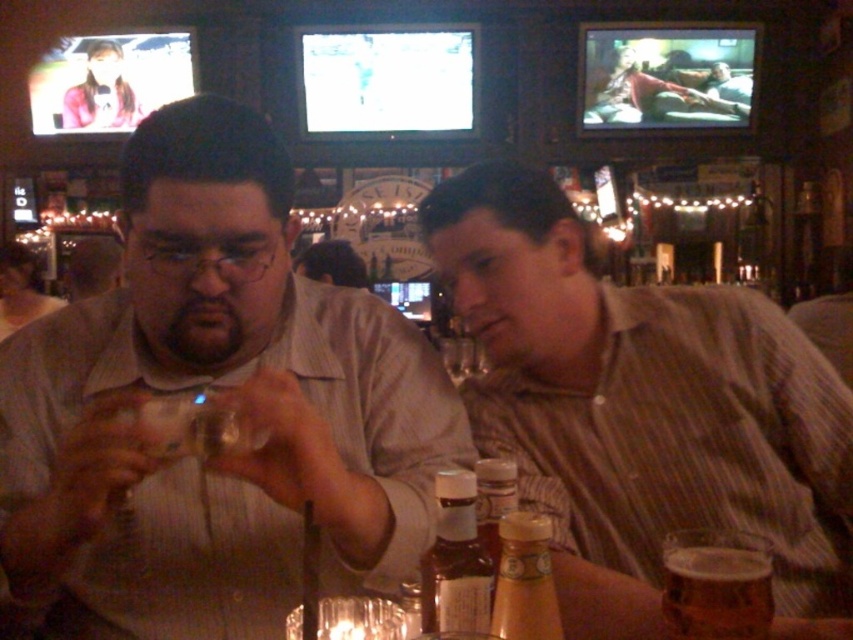
Question: Does matte brown shirt at center appear over translucent glass mug at lower right?

Choices:
 (A) no
 (B) yes

Answer: (B)

Question: Which point is farther to the camera?

Choices:
 (A) translucent glass bottle at center
 (B) translucent amber glass bottle at center

Answer: (A)

Question: Is matte brown shirt at center below brown striped shirt at center?

Choices:
 (A) yes
 (B) no

Answer: (B)

Question: Estimate the real-world distances between objects in this image. Which object is closer to the matte brown shirt at center?

Choices:
 (A) translucent amber glass bottle at center
 (B) brown striped shirt at center

Answer: (B)

Question: In this image, where is brown striped shirt at center located relative to translucent glass bottle at center?

Choices:
 (A) right
 (B) left

Answer: (A)

Question: Considering the real-world distances, which object is farthest from the brown striped shirt at center?

Choices:
 (A) translucent glass bottle at center
 (B) translucent glass mug at lower right

Answer: (A)